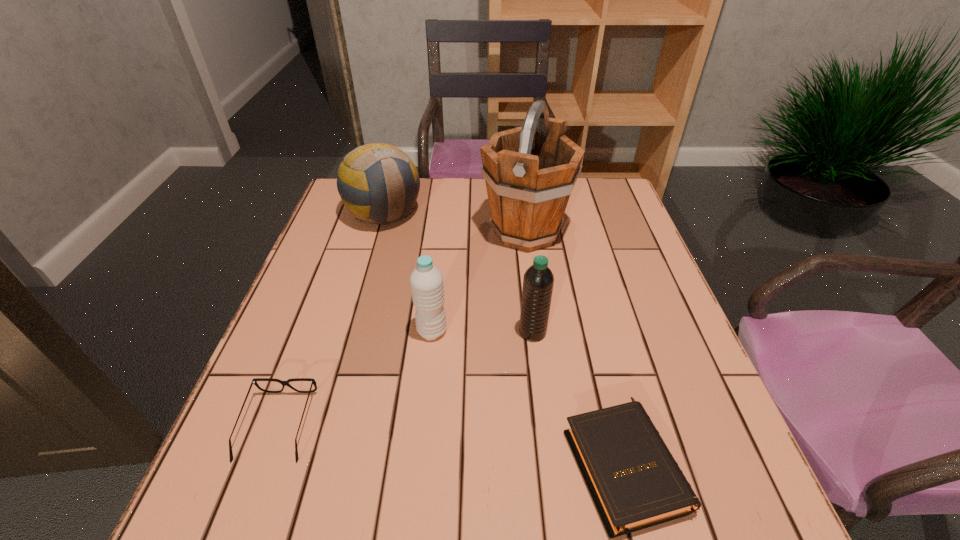
Where is `vacant region located on the back of the Bible`? Image resolution: width=960 pixels, height=540 pixels. vacant region located on the back of the Bible is located at coordinates (579, 282).

Image resolution: width=960 pixels, height=540 pixels. In order to click on bucket at the far edge in this screenshot , I will do `click(530, 171)`.

Identify the location of volleyball positioned at the far edge. The image size is (960, 540). (378, 183).

This screenshot has width=960, height=540. In order to click on object that is at the near edge in this screenshot , I will do `click(635, 483)`.

The width and height of the screenshot is (960, 540). I want to click on volleyball situated at the left edge, so click(x=378, y=183).

Locate an element on the screen. spectacles that is at the left edge is located at coordinates (254, 381).

Find the location of a particular element. The height and width of the screenshot is (540, 960). object that is at the right edge is located at coordinates (635, 483).

Where is `object present at the far left corner`? The width and height of the screenshot is (960, 540). object present at the far left corner is located at coordinates (378, 183).

You are a GUI agent. You are given a task and a screenshot of the screen. Output one action in this format:
    pyautogui.click(x=<x>, y=<y>)
    Task: Click on the object located at the near right corner
    The width and height of the screenshot is (960, 540).
    Given the screenshot: What is the action you would take?
    click(635, 483)

I want to click on vacant space at the far edge, so click(x=436, y=215).